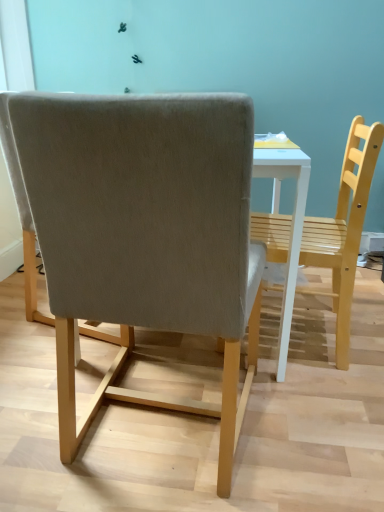
This screenshot has width=384, height=512. What do you see at coordinates (344, 228) in the screenshot?
I see `light brown wooden chair at center, marked as the 1th chair in a right-to-left arrangement` at bounding box center [344, 228].

Locate an element on the screen. light brown wooden chair at center, the second chair viewed from the left is located at coordinates (344, 228).

Identify the location of light gray fabric chair at center, which appears as the second chair when viewed from the right. (141, 233).

The image size is (384, 512). Describe the element at coordinates (141, 233) in the screenshot. I see `light gray fabric chair at center, which appears as the second chair when viewed from the right` at that location.

Identify the location of light brown wooden chair at center, the second chair viewed from the left. Image resolution: width=384 pixels, height=512 pixels. (344, 228).

Which is more to the left, light brown wooden chair at center, the second chair viewed from the left, or light gray fabric chair at center, which is counted as the 1th chair, starting from the left?

Positioned to the left is light gray fabric chair at center, which is counted as the 1th chair, starting from the left.

Which object is further away from the camera, light brown wooden chair at center, the second chair viewed from the left, or light gray fabric chair at center, which is counted as the 1th chair, starting from the left?

light brown wooden chair at center, the second chair viewed from the left, is further away from the camera.

Does point (342, 179) lie behind point (205, 117)?

Yes, point (342, 179) is farther from viewer.

From the image's perspective, which one is positioned lower, light brown wooden chair at center, the second chair viewed from the left, or light gray fabric chair at center, which appears as the second chair when viewed from the right?

light gray fabric chair at center, which appears as the second chair when viewed from the right, is shown below in the image.

From a real-world perspective, is light brown wooden chair at center, the second chair viewed from the left, on top of light gray fabric chair at center, which is counted as the 1th chair, starting from the left?

No, from a real-world perspective, light brown wooden chair at center, the second chair viewed from the left, is not above light gray fabric chair at center, which is counted as the 1th chair, starting from the left.

Which object is wider, light brown wooden chair at center, marked as the 1th chair in a right-to-left arrangement, or light gray fabric chair at center, which appears as the second chair when viewed from the right?

light gray fabric chair at center, which appears as the second chair when viewed from the right, is wider.

Can you confirm if light brown wooden chair at center, the second chair viewed from the left, is shorter than light gray fabric chair at center, which is counted as the 1th chair, starting from the left?

Correct, light brown wooden chair at center, the second chair viewed from the left, is not as tall as light gray fabric chair at center, which is counted as the 1th chair, starting from the left.

Considering the sizes of light brown wooden chair at center, the second chair viewed from the left, and light gray fabric chair at center, which appears as the second chair when viewed from the right, in the image, is light brown wooden chair at center, the second chair viewed from the left, bigger or smaller than light gray fabric chair at center, which appears as the second chair when viewed from the right,?

light brown wooden chair at center, the second chair viewed from the left, is smaller than light gray fabric chair at center, which appears as the second chair when viewed from the right.

Would you say light brown wooden chair at center, marked as the 1th chair in a right-to-left arrangement, is outside light gray fabric chair at center, which appears as the second chair when viewed from the right?

Indeed, light brown wooden chair at center, marked as the 1th chair in a right-to-left arrangement, is completely outside light gray fabric chair at center, which appears as the second chair when viewed from the right.

Is light brown wooden chair at center, marked as the 1th chair in a right-to-left arrangement, with light gray fabric chair at center, which appears as the second chair when viewed from the right?

light brown wooden chair at center, marked as the 1th chair in a right-to-left arrangement, and light gray fabric chair at center, which appears as the second chair when viewed from the right, are clearly separated.

Could you tell me if light brown wooden chair at center, marked as the 1th chair in a right-to-left arrangement, is facing light gray fabric chair at center, which appears as the second chair when viewed from the right?

No.

Where is `chair that is above the light gray fabric chair at center, which appears as the second chair when viewed from the right (from the image's perspective)`? This screenshot has height=512, width=384. chair that is above the light gray fabric chair at center, which appears as the second chair when viewed from the right (from the image's perspective) is located at coordinates (344, 228).

Considering the relative positions of light gray fabric chair at center, which is counted as the 1th chair, starting from the left, and light brown wooden chair at center, the second chair viewed from the left, in the image provided, is light gray fabric chair at center, which is counted as the 1th chair, starting from the left, to the left of light brown wooden chair at center, the second chair viewed from the left, from the viewer's perspective?

Yes, light gray fabric chair at center, which is counted as the 1th chair, starting from the left, is to the left of light brown wooden chair at center, the second chair viewed from the left.

Considering the relative positions of light gray fabric chair at center, which is counted as the 1th chair, starting from the left, and light brown wooden chair at center, marked as the 1th chair in a right-to-left arrangement, in the image provided, is light gray fabric chair at center, which is counted as the 1th chair, starting from the left, behind light brown wooden chair at center, marked as the 1th chair in a right-to-left arrangement,?

No, it is not.

From the picture: Which point is more distant from viewer, (56, 271) or (357, 146)?

Point (357, 146)

From the image's perspective, which one is positioned higher, light gray fabric chair at center, which is counted as the 1th chair, starting from the left, or light brown wooden chair at center, the second chair viewed from the left?

From the image's view, light brown wooden chair at center, the second chair viewed from the left, is above.

From a real-world perspective, is light gray fabric chair at center, which appears as the second chair when viewed from the right, located beneath light brown wooden chair at center, the second chair viewed from the left?

No, from a real-world perspective, light gray fabric chair at center, which appears as the second chair when viewed from the right, is not under light brown wooden chair at center, the second chair viewed from the left.

Looking at their sizes, would you say light gray fabric chair at center, which appears as the second chair when viewed from the right, is wider or thinner than light brown wooden chair at center, the second chair viewed from the left?

Considering their sizes, light gray fabric chair at center, which appears as the second chair when viewed from the right, looks broader than light brown wooden chair at center, the second chair viewed from the left.

Considering the sizes of light gray fabric chair at center, which is counted as the 1th chair, starting from the left, and light brown wooden chair at center, the second chair viewed from the left, in the image, is light gray fabric chair at center, which is counted as the 1th chair, starting from the left, taller or shorter than light brown wooden chair at center, the second chair viewed from the left,?

In the image, light gray fabric chair at center, which is counted as the 1th chair, starting from the left, appears to be taller than light brown wooden chair at center, the second chair viewed from the left.

Considering the sizes of light gray fabric chair at center, which is counted as the 1th chair, starting from the left, and light brown wooden chair at center, marked as the 1th chair in a right-to-left arrangement, in the image, is light gray fabric chair at center, which is counted as the 1th chair, starting from the left, bigger or smaller than light brown wooden chair at center, marked as the 1th chair in a right-to-left arrangement,?

In the image, light gray fabric chair at center, which is counted as the 1th chair, starting from the left, appears to be larger than light brown wooden chair at center, marked as the 1th chair in a right-to-left arrangement.

Is light brown wooden chair at center, marked as the 1th chair in a right-to-left arrangement, completely or partially inside light gray fabric chair at center, which is counted as the 1th chair, starting from the left?

No.

Is light gray fabric chair at center, which appears as the second chair when viewed from the right, not close to light brown wooden chair at center, marked as the 1th chair in a right-to-left arrangement?

No.

Is light gray fabric chair at center, which appears as the second chair when viewed from the right, aimed at light brown wooden chair at center, marked as the 1th chair in a right-to-left arrangement?

No, light gray fabric chair at center, which appears as the second chair when viewed from the right, is not oriented towards light brown wooden chair at center, marked as the 1th chair in a right-to-left arrangement.

From the picture: How different are the orientations of light gray fabric chair at center, which is counted as the 1th chair, starting from the left, and light brown wooden chair at center, the second chair viewed from the left, in degrees?

88.8 degrees.

How much distance is there between light gray fabric chair at center, which is counted as the 1th chair, starting from the left, and light brown wooden chair at center, the second chair viewed from the left?

The distance of light gray fabric chair at center, which is counted as the 1th chair, starting from the left, from light brown wooden chair at center, the second chair viewed from the left, is 59.32 centimeters.

The height and width of the screenshot is (512, 384). In order to click on chair that is on the right side of light gray fabric chair at center, which is counted as the 1th chair, starting from the left in this screenshot , I will do `click(344, 228)`.

Locate an element on the screen. This screenshot has height=512, width=384. chair on the right of the light gray fabric chair at center, which appears as the second chair when viewed from the right is located at coordinates (344, 228).

Identify the location of chair above the light brown wooden chair at center, the second chair viewed from the left (from a real-world perspective). (141, 233).